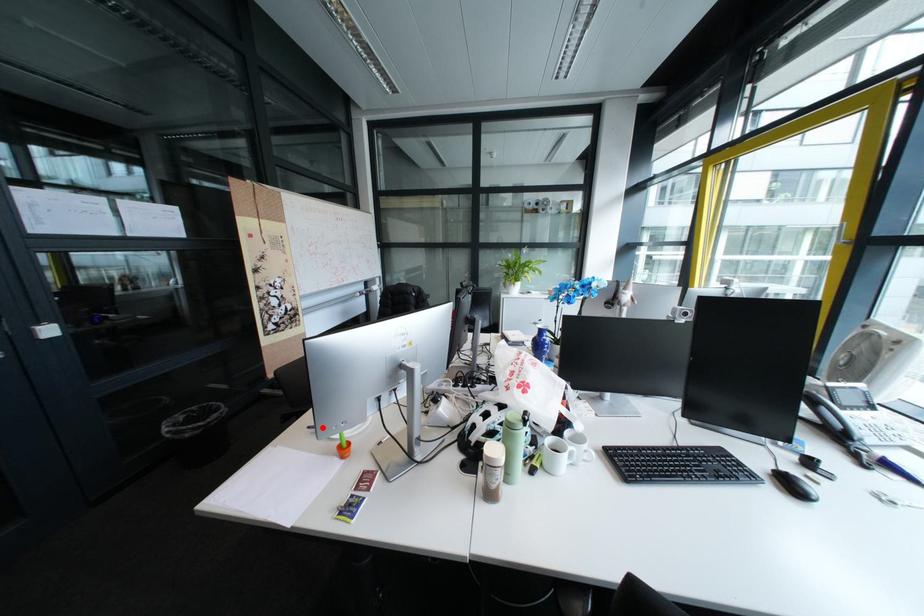
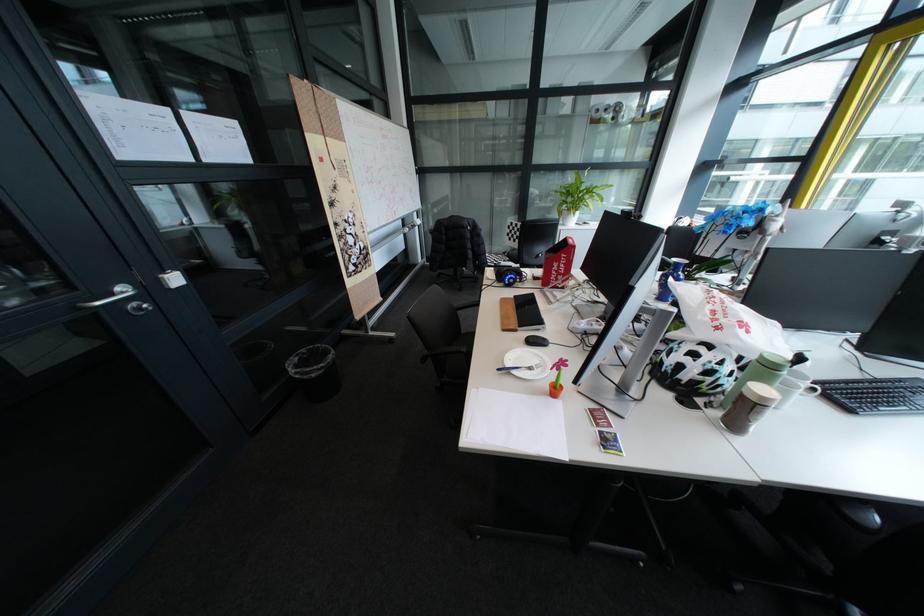
In the second image, find the point that corresponds to the highlighted location in the first image.

(513, 370)